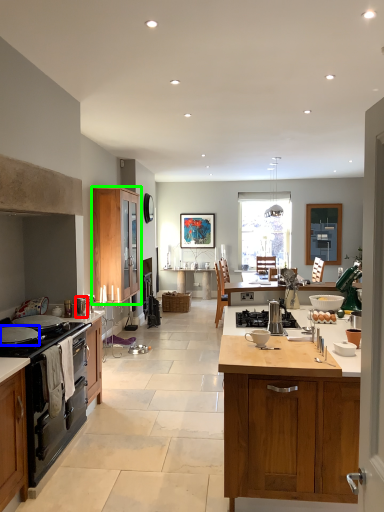
Question: Based on their relative distances, which object is nearer to appliance (highlighted by a red box)? Choose from kitchen appliance (highlighted by a blue box) and cabinetry (highlighted by a green box).

Choices:
 (A) kitchen appliance
 (B) cabinetry

Answer: (A)